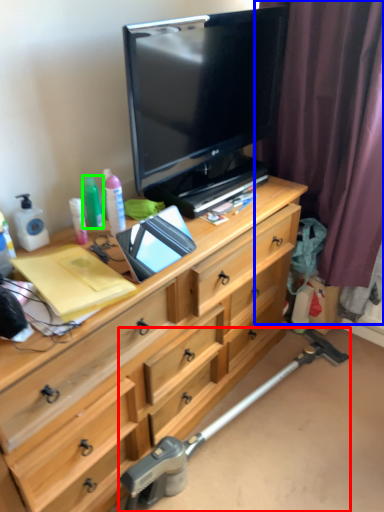
Question: Which is farther away from crutch (highlighted by a red box)? curtain (highlighted by a blue box) or bottle (highlighted by a green box)?

Choices:
 (A) curtain
 (B) bottle

Answer: (B)